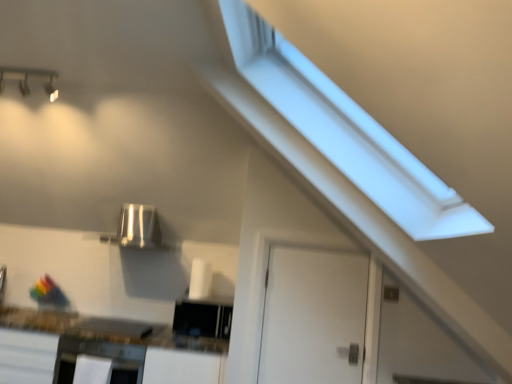
Describe the element at coordinates (313, 317) in the screenshot. Image resolution: width=512 pixels, height=384 pixels. I see `white matte door at center` at that location.

The image size is (512, 384). Describe the element at coordinates (202, 318) in the screenshot. I see `black glossy microwave at center, positioned as the first appliance in right-to-left order` at that location.

Describe the element at coordinates (137, 228) in the screenshot. I see `satin silver appliance at center, marked as the second appliance in a bottom-to-top arrangement` at that location.

Locate an element on the screen. This screenshot has width=512, height=384. matte silver light fixture at upper left is located at coordinates (27, 79).

The width and height of the screenshot is (512, 384). Find the location of `white glossy countertop at lower left`. white glossy countertop at lower left is located at coordinates (101, 349).

In the image, is white glossy countertop at lower left positioned in front of or behind white matte door at center?

In the image, white glossy countertop at lower left appears behind white matte door at center.

Could you tell me if white glossy countertop at lower left is turned towards white matte door at center?

No, white glossy countertop at lower left is not turned towards white matte door at center.

Looking at this image, is white glossy countertop at lower left inside the boundaries of white matte door at center, or outside?

white glossy countertop at lower left is located beyond the bounds of white matte door at center.

The width and height of the screenshot is (512, 384). Find the location of `door located in front of the white glossy countertop at lower left`. door located in front of the white glossy countertop at lower left is located at coordinates (313, 317).

Would you consider satin black oven at lower left to be distant from black glossy microwave at center, positioned as the first appliance in right-to-left order?

No, satin black oven at lower left is not far away from black glossy microwave at center, positioned as the first appliance in right-to-left order.

Is satin black oven at lower left facing towards black glossy microwave at center, the 2th appliance positioned from the left?

No, satin black oven at lower left does not turn towards black glossy microwave at center, the 2th appliance positioned from the left.

From a real-world perspective, count 1st appliances upward from the satin black oven at lower left and point to it. Please provide its 2D coordinates.

[(202, 318)]

Measure the distance between satin black oven at lower left and satin silver appliance at center, marked as the second appliance in a bottom-to-top arrangement.

satin black oven at lower left is 93.66 centimeters away from satin silver appliance at center, marked as the second appliance in a bottom-to-top arrangement.

Identify the location of the 2nd appliance located above the satin black oven at lower left (from a real-world perspective). (137, 228).

Is satin black oven at lower left positioned with its back to satin silver appliance at center, acting as the first appliance starting from the left?

No, satin black oven at lower left is not facing away from satin silver appliance at center, acting as the first appliance starting from the left.

Is satin black oven at lower left in contact with satin silver appliance at center, the 2th appliance in the right-to-left sequence?

No.

From the picture: Is satin silver appliance at center, the 2th appliance in the right-to-left sequence, positioned behind white glossy countertop at lower left?

Yes, satin silver appliance at center, the 2th appliance in the right-to-left sequence, is behind white glossy countertop at lower left.

Is satin silver appliance at center, the 2th appliance in the right-to-left sequence, not within white glossy countertop at lower left?

satin silver appliance at center, the 2th appliance in the right-to-left sequence, is positioned outside white glossy countertop at lower left.

Where is `countertop below the satin silver appliance at center, the first appliance in the top-to-bottom sequence (from the image's perspective)`? This screenshot has height=384, width=512. countertop below the satin silver appliance at center, the first appliance in the top-to-bottom sequence (from the image's perspective) is located at coordinates (101, 349).

Is satin black oven at lower left next to matte silver light fixture at upper left and touching it?

No, satin black oven at lower left is not next to matte silver light fixture at upper left.

Does satin black oven at lower left lie behind matte silver light fixture at upper left?

Yes.

Is matte silver light fixture at upper left inside satin black oven at lower left?

No, matte silver light fixture at upper left is not surrounded by satin black oven at lower left.

Does satin black oven at lower left have a smaller size compared to matte silver light fixture at upper left?

Actually, satin black oven at lower left might be larger than matte silver light fixture at upper left.

Is satin silver appliance at center, the first appliance in the top-to-bottom sequence, at the back of white matte door at center?

No, satin silver appliance at center, the first appliance in the top-to-bottom sequence, is not at the back of white matte door at center.

Which object is wider, white matte door at center or satin silver appliance at center, the first appliance in the top-to-bottom sequence?

satin silver appliance at center, the first appliance in the top-to-bottom sequence, is wider.

Are white matte door at center and satin silver appliance at center, marked as the second appliance in a bottom-to-top arrangement, located far from each other?

Yes, white matte door at center and satin silver appliance at center, marked as the second appliance in a bottom-to-top arrangement, are located far from each other.

Which object is closer to the camera, white matte door at center or satin silver appliance at center, the first appliance in the top-to-bottom sequence?

white matte door at center is closer to the camera.

Can you confirm if white matte door at center is wider than matte silver light fixture at upper left?

In fact, white matte door at center might be narrower than matte silver light fixture at upper left.

Considering the sizes of objects white matte door at center and matte silver light fixture at upper left in the image provided, who is taller, white matte door at center or matte silver light fixture at upper left?

white matte door at center is taller.

Looking at the image, does white matte door at center seem bigger or smaller compared to matte silver light fixture at upper left?

Considering their sizes, white matte door at center takes up more space than matte silver light fixture at upper left.

Can you confirm if white matte door at center is positioned to the right of matte silver light fixture at upper left?

Yes, white matte door at center is to the right of matte silver light fixture at upper left.

Find the location of `door in front of the white glossy countertop at lower left`. door in front of the white glossy countertop at lower left is located at coordinates pos(313,317).

Starting from the satin black oven at lower left, which appliance is the 2nd one to the right? Please provide its 2D coordinates.

[(202, 318)]

Looking at the image, which one is located closer to matte silver light fixture at upper left, satin black oven at lower left or white glossy countertop at lower left?

Based on the image, satin black oven at lower left appears to be nearer to matte silver light fixture at upper left.

Considering their positions, is satin silver appliance at center, marked as the second appliance in a bottom-to-top arrangement, positioned further to white matte door at center than satin black oven at lower left?

The object further to white matte door at center is satin silver appliance at center, marked as the second appliance in a bottom-to-top arrangement.

Which object lies further to the anchor point white glossy countertop at lower left, black glossy microwave at center, the 2th appliance positioned from the left, or white matte door at center?

white matte door at center lies further to white glossy countertop at lower left than the other object.

Looking at the image, which one is located closer to black glossy microwave at center, arranged as the second appliance when viewed from the top, white glossy countertop at lower left or matte silver light fixture at upper left?

white glossy countertop at lower left.

Based on their spatial positions, is white glossy countertop at lower left or matte silver light fixture at upper left closer to white matte door at center?

Based on the image, white glossy countertop at lower left appears to be nearer to white matte door at center.

When comparing their distances from white glossy countertop at lower left, does satin silver appliance at center, the first appliance in the top-to-bottom sequence, or white matte door at center seem closer?

white matte door at center is closer to white glossy countertop at lower left.

When comparing their distances from matte silver light fixture at upper left, does white matte door at center or white glossy countertop at lower left seem closer?

white glossy countertop at lower left is closer to matte silver light fixture at upper left.

Based on their spatial positions, is white matte door at center or satin black oven at lower left further from satin silver appliance at center, the first appliance in the top-to-bottom sequence?

white matte door at center lies further to satin silver appliance at center, the first appliance in the top-to-bottom sequence, than the other object.

Where is `oven that lies between matte silver light fixture at upper left and white glossy countertop at lower left from top to bottom`? This screenshot has width=512, height=384. oven that lies between matte silver light fixture at upper left and white glossy countertop at lower left from top to bottom is located at coordinates (98, 360).

Find the location of a particular element. door between matte silver light fixture at upper left and white glossy countertop at lower left in the up-down direction is located at coordinates (313, 317).

Locate an element on the screen. oven between white glossy countertop at lower left and white matte door at center in the horizontal direction is located at coordinates (98, 360).

Find the location of `oven that lies between satin silver appliance at center, acting as the first appliance starting from the left, and white glossy countertop at lower left from top to bottom`. oven that lies between satin silver appliance at center, acting as the first appliance starting from the left, and white glossy countertop at lower left from top to bottom is located at coordinates (98, 360).